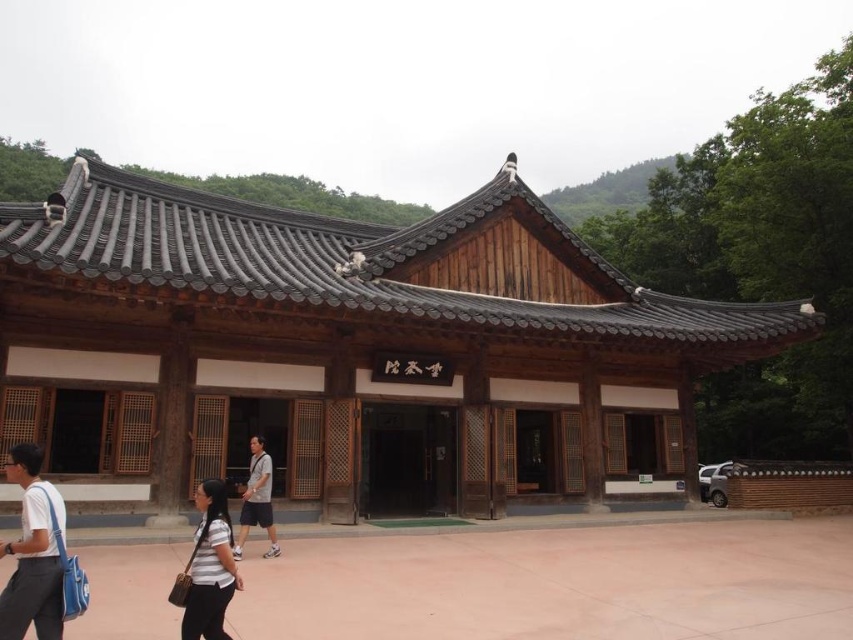
Does brown wooden temple at center appear on the right side of striped fabric shirt at lower center?

Yes, brown wooden temple at center is to the right of striped fabric shirt at lower center.

Is point (770, 352) closer to camera compared to point (212, 524)?

No, it is not.

Identify the location of brown wooden temple at center. The image size is (853, 640). (347, 349).

Does brown wooden temple at center have a lesser width compared to gray fabric shirt at center?

In fact, brown wooden temple at center might be wider than gray fabric shirt at center.

Does point (436, 444) lie in front of point (256, 435)?

No.

Between point (260, 310) and point (248, 497), which one is positioned in front?

Point (248, 497)

Identify the location of brown wooden temple at center. (347, 349).

Is white cotton shirt at lower left positioned before striped fabric shirt at lower center?

Yes, it is in front of striped fabric shirt at lower center.

Is point (61, 621) behind point (229, 545)?

No.

Describe the element at coordinates (33, 552) in the screenshot. This screenshot has width=853, height=640. I see `white cotton shirt at lower left` at that location.

Locate an element on the screen. white cotton shirt at lower left is located at coordinates (33, 552).